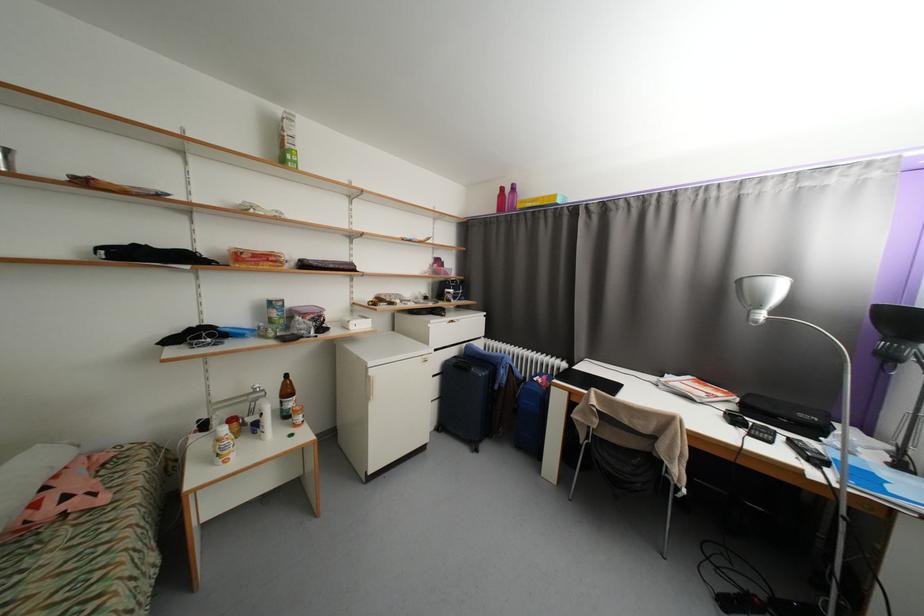
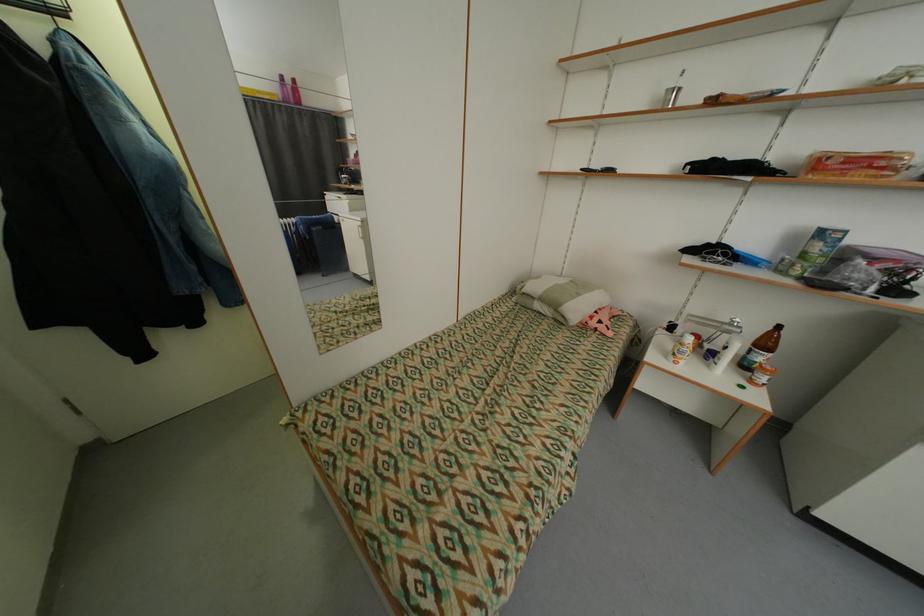
In the second image, find the point that corresponds to [294,392] in the first image.

(772, 345)